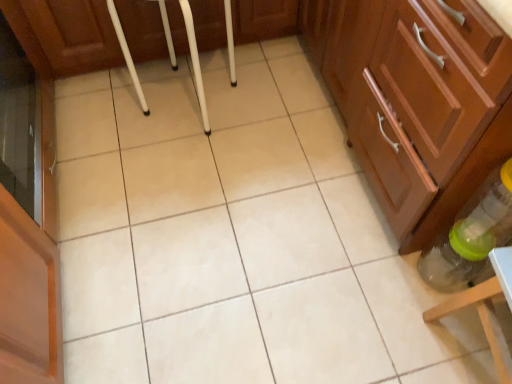
Question: Is point (476, 135) positioned closer to the camera than point (501, 233)?

Choices:
 (A) farther
 (B) closer

Answer: (B)

Question: In terms of size, does matte wood cabinet at center-right, the 1th cabinetry positioned from the bottom, appear bigger or smaller than translucent plastic bottle at lower right?

Choices:
 (A) big
 (B) small

Answer: (A)

Question: Which object is positioned closest to the translucent plastic bottle at lower right?

Choices:
 (A) matte wood cabinet at center-right, the 1th cabinetry positioned from the bottom
 (B) wooden cabinet at center, which appears as the second cabinetry when ordered from the bottom
 (C) white plastic bar stool at center

Answer: (A)

Question: Which object is positioned farthest from the white plastic bar stool at center?

Choices:
 (A) translucent plastic bottle at lower right
 (B) matte wood cabinet at center-right, the 1th cabinetry positioned from the bottom
 (C) wooden cabinet at center, which appears as the second cabinetry when ordered from the bottom

Answer: (A)